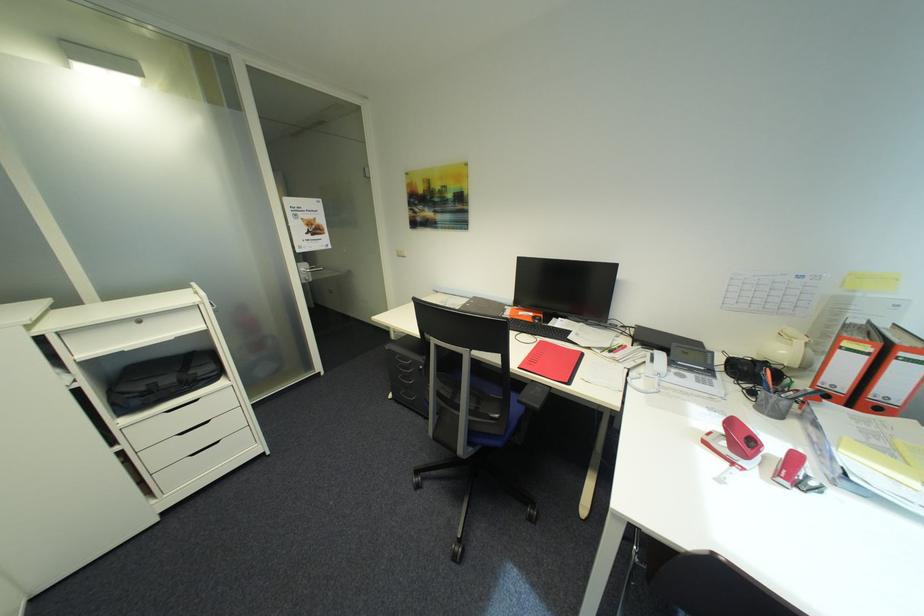
The width and height of the screenshot is (924, 616). Find the location of `black pen holder`. black pen holder is located at coordinates (768, 386).